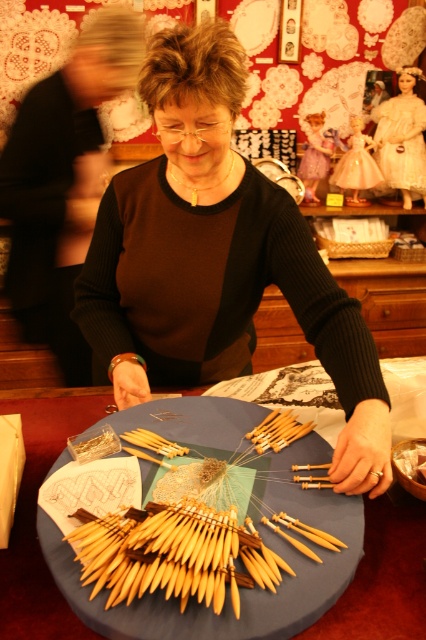
Question: Which of these objects is positioned farthest from the matte black sweater at center?

Choices:
 (A) wooden knitting needles at center
 (B) white lace dress at center

Answer: (B)

Question: Which is nearer to the matte black sweater at center?

Choices:
 (A) wooden knitting needles at center
 (B) white lace dress at center

Answer: (A)

Question: Does wooden knitting needles at center appear on the right side of white lace dress at center?

Choices:
 (A) no
 (B) yes

Answer: (A)

Question: Which point is closer to the camera?

Choices:
 (A) (249, 420)
 (B) (203, 225)

Answer: (A)

Question: Is matte black sweater at center further to the viewer compared to white lace dress at center?

Choices:
 (A) yes
 (B) no

Answer: (B)

Question: Is matte black sweater at center below white lace dress at center?

Choices:
 (A) no
 (B) yes

Answer: (B)